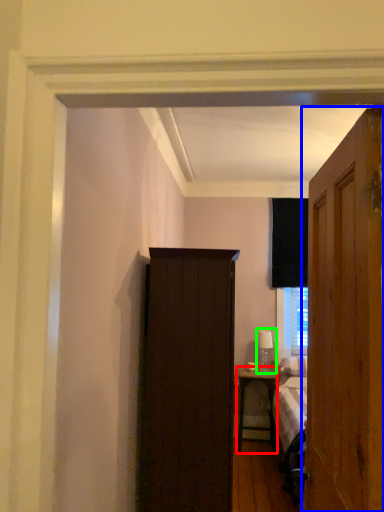
Question: Which object is positioned closest to nightstand (highlighted by a red box)? Select from door (highlighted by a blue box) and table lamp (highlighted by a green box).

Choices:
 (A) door
 (B) table lamp

Answer: (B)